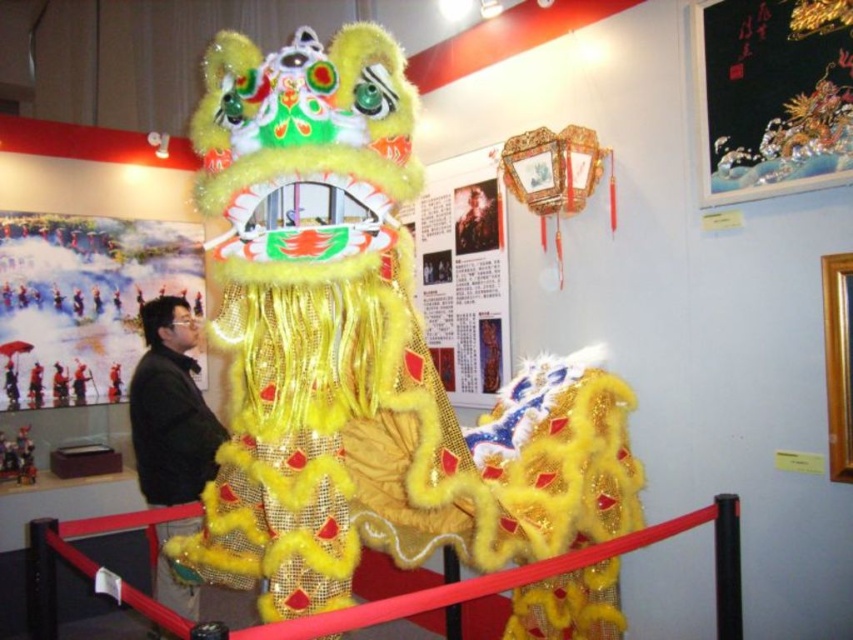
Does rubberized plastic barrier at center have a smaller size compared to matte paper poster at center?

Actually, rubberized plastic barrier at center might be larger than matte paper poster at center.

Between point (109, 595) and point (479, 326), which one is positioned in front?

Point (109, 595)

What do you see at coordinates (538, 579) in the screenshot? I see `rubberized plastic barrier at center` at bounding box center [538, 579].

Identify the location of rubberized plastic barrier at center. Image resolution: width=853 pixels, height=640 pixels. point(538,579).

Is black silk scroll at upper right in front of black fabric jacket at center?

Yes, black silk scroll at upper right is closer to the viewer.

Which is in front, point (795, 104) or point (165, 577)?

Point (795, 104) is in front.

This screenshot has height=640, width=853. I want to click on black silk scroll at upper right, so click(x=775, y=96).

Can you confirm if matte paper poster at center is taller than black fabric jacket at center?

Incorrect, matte paper poster at center's height is not larger of black fabric jacket at center's.

This screenshot has width=853, height=640. Identify the location of matte paper poster at center. (463, 273).

You are a GUI agent. You are given a task and a screenshot of the screen. Output one action in this format:
    pyautogui.click(x=<x>, y=<y>)
    Task: Click on the matte paper poster at center
    Image resolution: width=853 pixels, height=640 pixels.
    Given the screenshot: What is the action you would take?
    pyautogui.click(x=463, y=273)